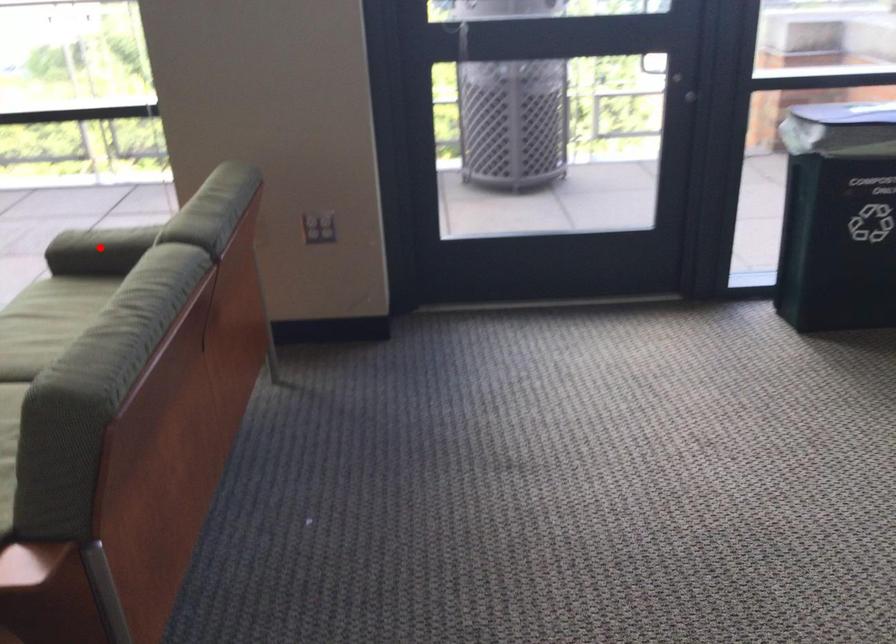
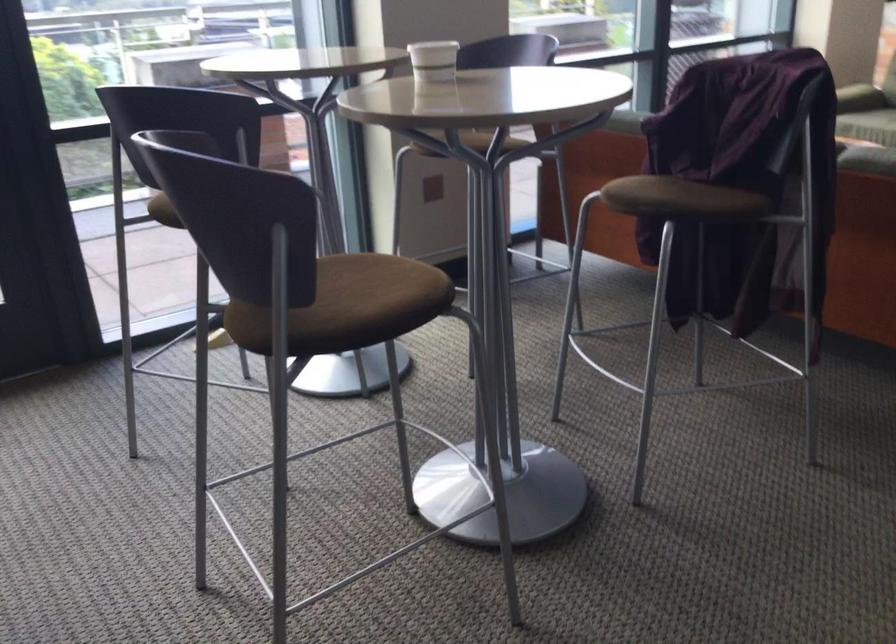
Question: I am providing you with two images of the same scene from different viewpoints. A red point is marked on the first image. Can you still see the location of the red point in image 2?

Choices:
 (A) Yes
 (B) No

Answer: (B)